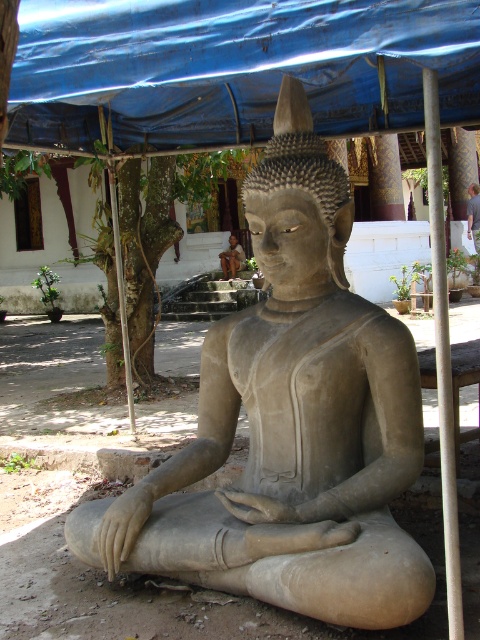
Question: Which point appears closest to the camera in this image?

Choices:
 (A) (336, 522)
 (B) (382, 96)
 (C) (116, 236)

Answer: (A)

Question: Is white smooth pole at right above metallic pole at left?

Choices:
 (A) yes
 (B) no

Answer: (A)

Question: Which object is closer to the camera taking this photo?

Choices:
 (A) gray stone statue at center
 (B) blue tarpaulin at upper center
 (C) white smooth pole at right

Answer: (C)

Question: Is gray stone statue at center positioned in front of metallic pole at left?

Choices:
 (A) no
 (B) yes

Answer: (B)

Question: Which point is closer to the camera?

Choices:
 (A) (369, 32)
 (B) (268, 396)
 (C) (129, 346)

Answer: (A)

Question: Can you confirm if white smooth pole at right is smaller than metallic pole at left?

Choices:
 (A) no
 (B) yes

Answer: (A)